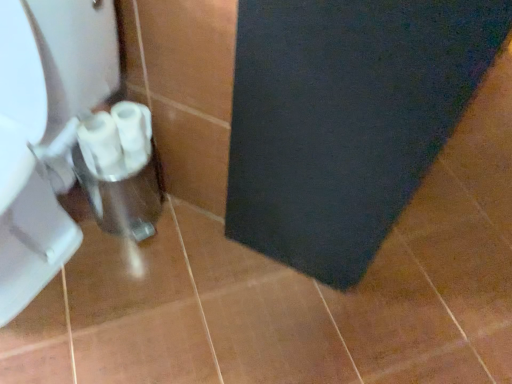
Question: From the image's perspective, does white glossy toilet paper at lower left, the second toilet paper in the right-to-left sequence, appear higher than dark blue felt bath mat at lower right?

Choices:
 (A) yes
 (B) no

Answer: (B)

Question: From a real-world perspective, is white glossy toilet paper at lower left, the second toilet paper in the right-to-left sequence, located higher than dark blue felt bath mat at lower right?

Choices:
 (A) yes
 (B) no

Answer: (B)

Question: Is white glossy toilet paper at lower left, the first toilet paper when ordered from left to right, beside dark blue felt bath mat at lower right?

Choices:
 (A) no
 (B) yes

Answer: (A)

Question: Is white glossy toilet paper at lower left, the second toilet paper in the right-to-left sequence, closer to camera compared to dark blue felt bath mat at lower right?

Choices:
 (A) yes
 (B) no

Answer: (B)

Question: From a real-world perspective, is white glossy toilet paper at lower left, the second toilet paper in the right-to-left sequence, below dark blue felt bath mat at lower right?

Choices:
 (A) yes
 (B) no

Answer: (A)

Question: Could you tell me if white glossy toilet paper at lower left, the second toilet paper in the right-to-left sequence, is facing dark blue felt bath mat at lower right?

Choices:
 (A) no
 (B) yes

Answer: (A)

Question: From the image's perspective, is white plastic toilet paper at lower left, which is the 1th toilet paper in right-to-left order, located above dark blue felt bath mat at lower right?

Choices:
 (A) no
 (B) yes

Answer: (A)

Question: Can you confirm if white plastic toilet paper at lower left, which is the 1th toilet paper in right-to-left order, is shorter than dark blue felt bath mat at lower right?

Choices:
 (A) yes
 (B) no

Answer: (A)

Question: Is white plastic toilet paper at lower left, the 2th toilet paper in the left-to-right sequence, to the right of dark blue felt bath mat at lower right from the viewer's perspective?

Choices:
 (A) no
 (B) yes

Answer: (A)

Question: From a real-world perspective, is white plastic toilet paper at lower left, the 2th toilet paper in the left-to-right sequence, located higher than dark blue felt bath mat at lower right?

Choices:
 (A) no
 (B) yes

Answer: (A)

Question: Considering the relative sizes of white plastic toilet paper at lower left, which is the 1th toilet paper in right-to-left order, and dark blue felt bath mat at lower right in the image provided, is white plastic toilet paper at lower left, which is the 1th toilet paper in right-to-left order, bigger than dark blue felt bath mat at lower right?

Choices:
 (A) no
 (B) yes

Answer: (A)

Question: From the image's perspective, would you say white plastic toilet paper at lower left, which is the 1th toilet paper in right-to-left order, is shown under white glossy toilet paper at lower left, the second toilet paper in the right-to-left sequence?

Choices:
 (A) yes
 (B) no

Answer: (B)